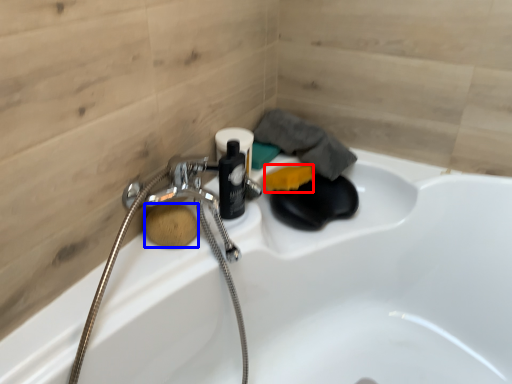
Question: Among these objects, which one is farthest to the camera, soap (highlighted by a red box) or soap (highlighted by a blue box)?

Choices:
 (A) soap
 (B) soap

Answer: (A)